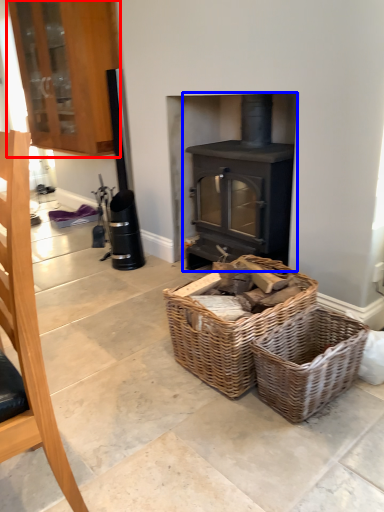
Question: Which point is closer to the camera, cabinetry (highlighted by a red box) or wood burning stove (highlighted by a blue box)?

Choices:
 (A) cabinetry
 (B) wood burning stove

Answer: (B)